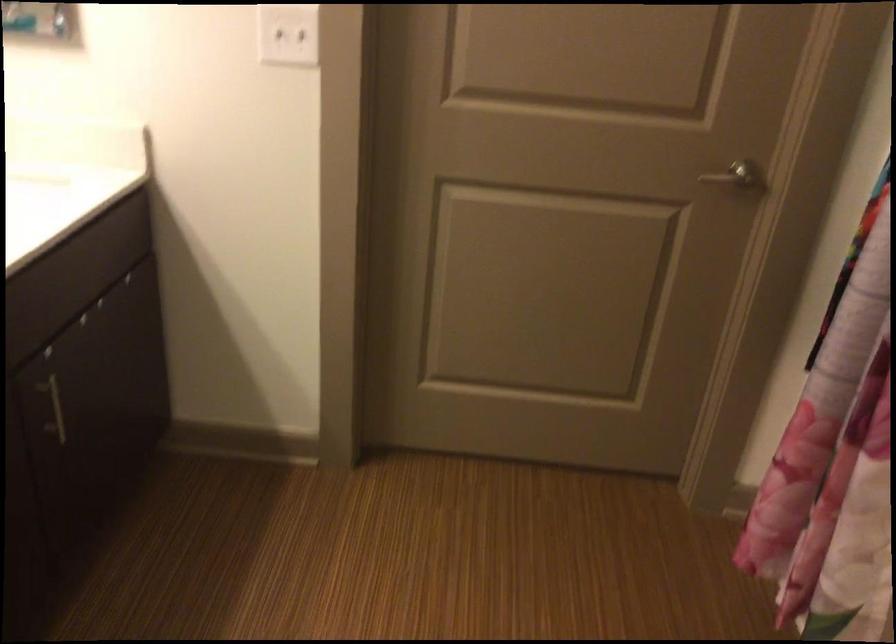
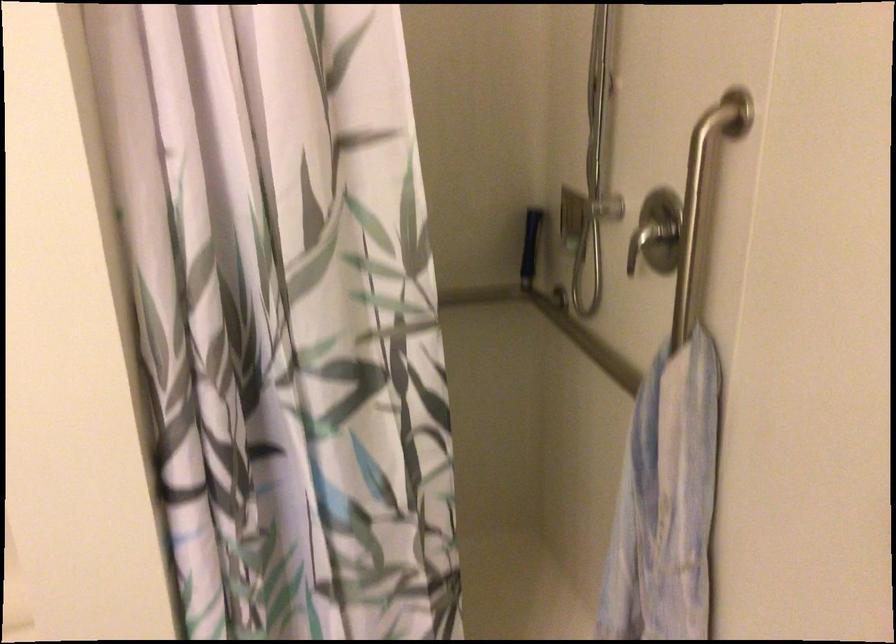
Looking at this image, the images are taken continuously from a first-person perspective. In which direction is your viewpoint rotating?

The rotation direction of the camera is right-down.